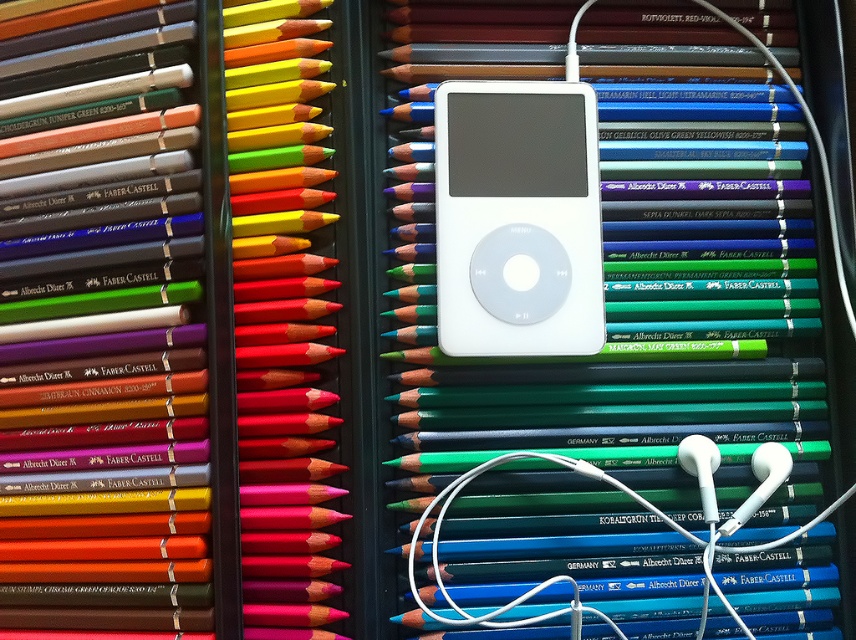
Identify the location of matte red pencil at center. Image resolution: width=856 pixels, height=640 pixels. (281, 321).

Which is behind, point (300, 108) or point (480, 243)?

Point (300, 108)

Image resolution: width=856 pixels, height=640 pixels. I want to click on matte red pencil at center, so click(281, 321).

Does green matte pencil at center appear on the left side of matte red pencil at center?

Incorrect, green matte pencil at center is not on the left side of matte red pencil at center.

This screenshot has width=856, height=640. What are the coordinates of `green matte pencil at center` in the screenshot? It's located at (622, 401).

Can you confirm if green matte pencil at center is wider than white matte ipod at center?

Yes, green matte pencil at center is wider than white matte ipod at center.

Does point (467, 403) come behind point (515, 234)?

Yes, point (467, 403) is behind point (515, 234).

At what (x,y) coordinates should I click in order to perform the action: click on green matte pencil at center. Please return your answer as a coordinate pair (x, y). Image resolution: width=856 pixels, height=640 pixels. Looking at the image, I should click on (622, 401).